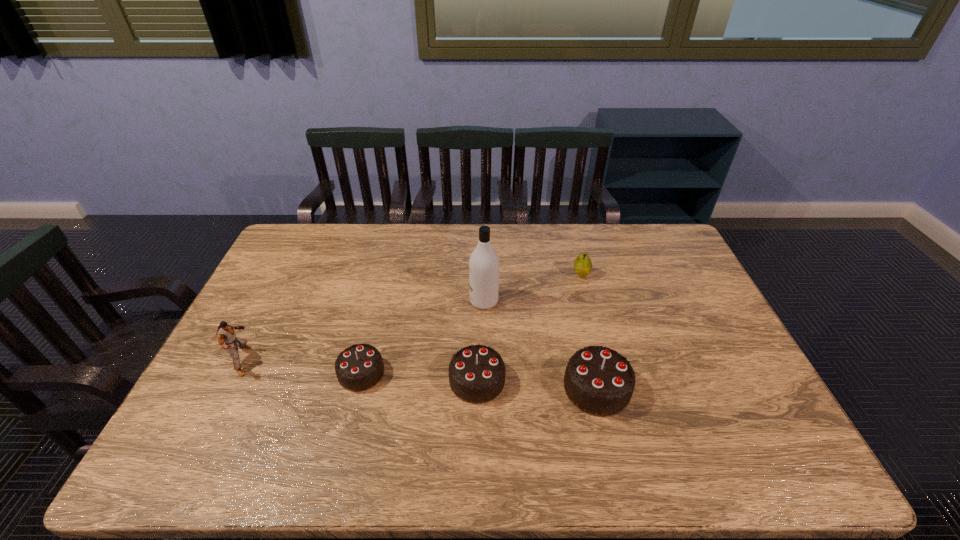
At what (x,y) coordinates should I click in order to perform the action: click on the fifth closest object to the shampoo. Please return your answer as a coordinate pair (x, y). This screenshot has width=960, height=540. Looking at the image, I should click on (225, 333).

You are a GUI agent. You are given a task and a screenshot of the screen. Output one action in this format:
    pyautogui.click(x=<x>, y=<y>)
    Task: Click on the second closest chocolate cake to the puncher
    Image resolution: width=960 pixels, height=540 pixels.
    Given the screenshot: What is the action you would take?
    [x=476, y=374]

At what (x,y) coordinates should I click in order to perform the action: click on chocolate cake identified as the second closest to the puncher. Please return your answer as a coordinate pair (x, y). This screenshot has height=540, width=960. Looking at the image, I should click on [x=476, y=374].

Image resolution: width=960 pixels, height=540 pixels. I want to click on free location that satisfies the following two spatial constraints: 1. on the front-facing side of the leftmost object; 2. on the right side of the rightmost chocolate cake, so click(x=229, y=388).

Where is `vacant area that satisfies the following two spatial constraints: 1. on the front-facing side of the tallest object; 2. on the left side of the rightmost chocolate cake`? vacant area that satisfies the following two spatial constraints: 1. on the front-facing side of the tallest object; 2. on the left side of the rightmost chocolate cake is located at coordinates point(485,388).

Locate an element on the screen. The height and width of the screenshot is (540, 960). blank space that satisfies the following two spatial constraints: 1. on the front side of the pear; 2. on the front-facing side of the leftmost object is located at coordinates (604, 360).

I want to click on free space that satisfies the following two spatial constraints: 1. on the back side of the second tallest chocolate cake; 2. on the right side of the pear, so click(x=478, y=275).

Find the location of a particular element. The image size is (960, 540). blank space that satisfies the following two spatial constraints: 1. on the front-facing side of the puncher; 2. on the left side of the second object from left to right is located at coordinates (237, 373).

Where is `vacant region that satisfies the following two spatial constraints: 1. on the front side of the second chocolate cake from right to left; 2. on the left side of the rightmost chocolate cake`? The height and width of the screenshot is (540, 960). vacant region that satisfies the following two spatial constraints: 1. on the front side of the second chocolate cake from right to left; 2. on the left side of the rightmost chocolate cake is located at coordinates [x=477, y=388].

In order to click on vacant space that satisfies the following two spatial constraints: 1. on the front-facing side of the puncher; 2. on the back side of the shortest chocolate cake in this screenshot , I will do `click(237, 373)`.